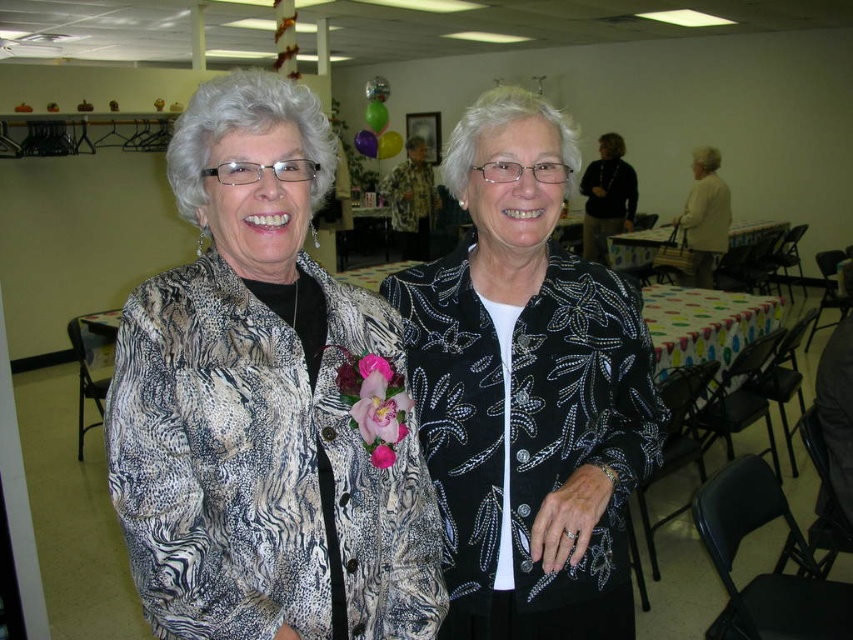
Question: Observing the image, what is the correct spatial positioning of zebra print jacket at center in reference to black sequined jacket at center?

Choices:
 (A) left
 (B) right

Answer: (A)

Question: Is zebra print jacket at center below black sequined jacket at center?

Choices:
 (A) yes
 (B) no

Answer: (B)

Question: Which of the following is the closest to the observer?

Choices:
 (A) (488, 340)
 (B) (339, 588)

Answer: (B)

Question: Can you confirm if zebra print jacket at center is positioned above black sequined jacket at center?

Choices:
 (A) yes
 (B) no

Answer: (A)

Question: Which object appears closest to the camera in this image?

Choices:
 (A) black sequined jacket at center
 (B) zebra print jacket at center

Answer: (B)